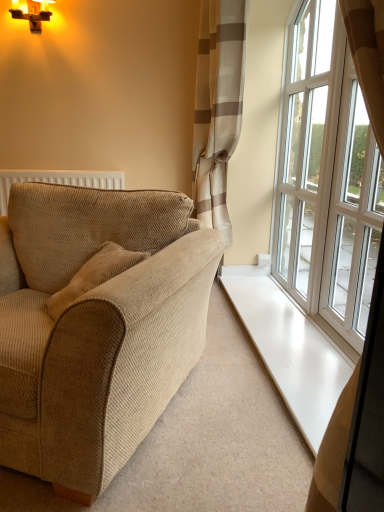
Question: From a real-world perspective, is beige corduroy couch at left positioned under white glass window at right, acting as the 2th window starting from the front, based on gravity?

Choices:
 (A) yes
 (B) no

Answer: (A)

Question: Is beige corduroy couch at left to the right of white glass window at right, which is counted as the 1th window, starting from the back, from the viewer's perspective?

Choices:
 (A) no
 (B) yes

Answer: (A)

Question: Does beige corduroy couch at left have a lesser height compared to white glass window at right, which is counted as the 1th window, starting from the back?

Choices:
 (A) no
 (B) yes

Answer: (B)

Question: Is beige corduroy couch at left taller than white glass window at right, which is counted as the 1th window, starting from the back?

Choices:
 (A) no
 (B) yes

Answer: (A)

Question: Is beige corduroy couch at left not inside white glass window at right, acting as the 2th window starting from the front?

Choices:
 (A) yes
 (B) no

Answer: (A)

Question: From a real-world perspective, relative to white glass window at right, positioned as the second window in back-to-front order, is white glass window at right, acting as the 2th window starting from the front, vertically above or below?

Choices:
 (A) below
 (B) above

Answer: (B)

Question: Is white glass window at right, acting as the 2th window starting from the front, situated inside white glass window at right, which is the first window from front to back, or outside?

Choices:
 (A) outside
 (B) inside

Answer: (A)

Question: Based on their sizes in the image, would you say white glass window at right, which is counted as the 1th window, starting from the back, is bigger or smaller than white glass window at right, positioned as the second window in back-to-front order?

Choices:
 (A) big
 (B) small

Answer: (A)

Question: In terms of width, does white glass window at right, acting as the 2th window starting from the front, look wider or thinner when compared to white glass window at right, positioned as the second window in back-to-front order?

Choices:
 (A) thin
 (B) wide

Answer: (A)

Question: Is point (114, 371) closer or farther from the camera than point (327, 240)?

Choices:
 (A) farther
 (B) closer

Answer: (B)

Question: From a real-world perspective, relative to white glass window at right, which is the first window from front to back, is beige corduroy couch at left vertically above or below?

Choices:
 (A) above
 (B) below

Answer: (B)

Question: From their relative heights in the image, would you say beige corduroy couch at left is taller or shorter than white glass window at right, positioned as the second window in back-to-front order?

Choices:
 (A) short
 (B) tall

Answer: (A)

Question: Is beige corduroy couch at left in front of or behind white glass window at right, which is the first window from front to back, in the image?

Choices:
 (A) behind
 (B) front

Answer: (B)

Question: Looking at their shapes, would you say beige textured curtain at upper right is wider or thinner than white glass window at right, positioned as the second window in back-to-front order?

Choices:
 (A) wide
 (B) thin

Answer: (A)

Question: In the image, is beige textured curtain at upper right on the left side or the right side of white glass window at right, which is the first window from front to back?

Choices:
 (A) right
 (B) left

Answer: (B)